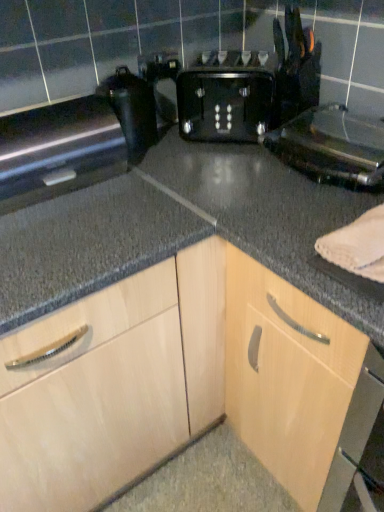
At what (x,y) coordinates should I click in order to perform the action: click on vacant space that is in between black plastic toaster at upper center, marked as the 1th appliance in a right-to-left arrangement, and black glossy coffee maker at upper left, placed as the second appliance when sorted from right to left. Please return your answer as a coordinate pair (x, y). Image resolution: width=384 pixels, height=512 pixels. Looking at the image, I should click on (225, 166).